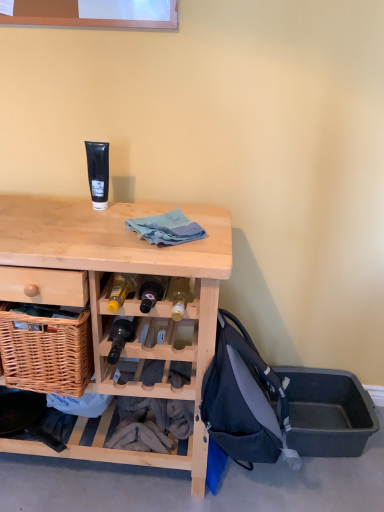
Locate an element on the screen. vacant space positioned to the left of blue cotton cloth at center is located at coordinates (102, 228).